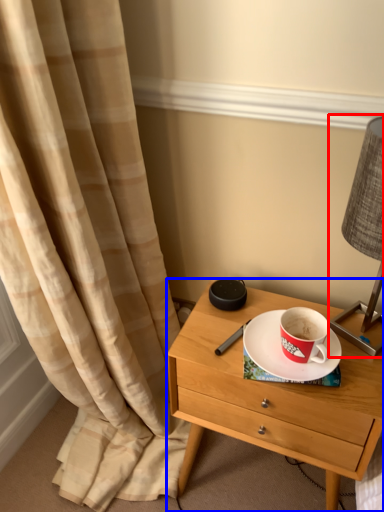
Question: Which object is further to the camera taking this photo, bedside lamp (highlighted by a red box) or nightstand (highlighted by a blue box)?

Choices:
 (A) bedside lamp
 (B) nightstand

Answer: (B)